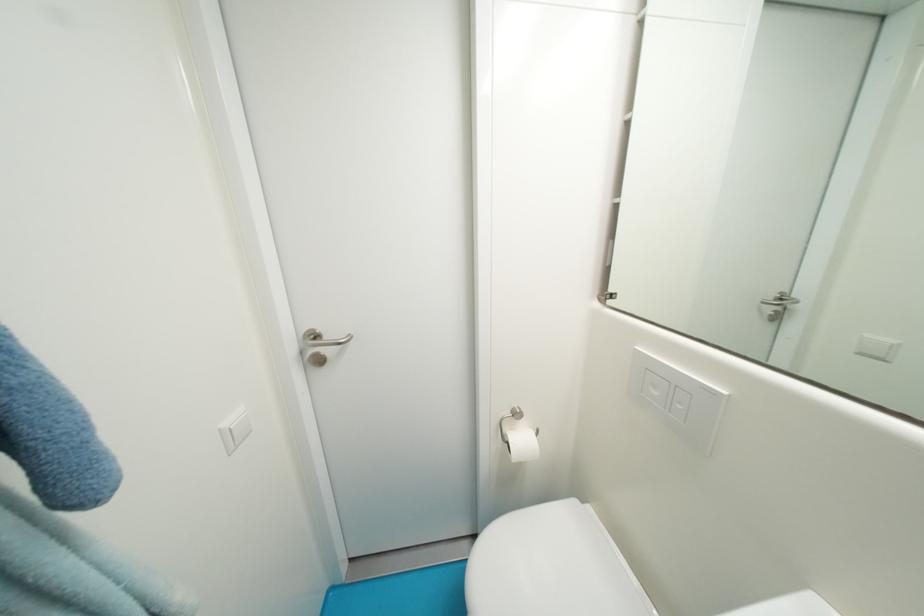
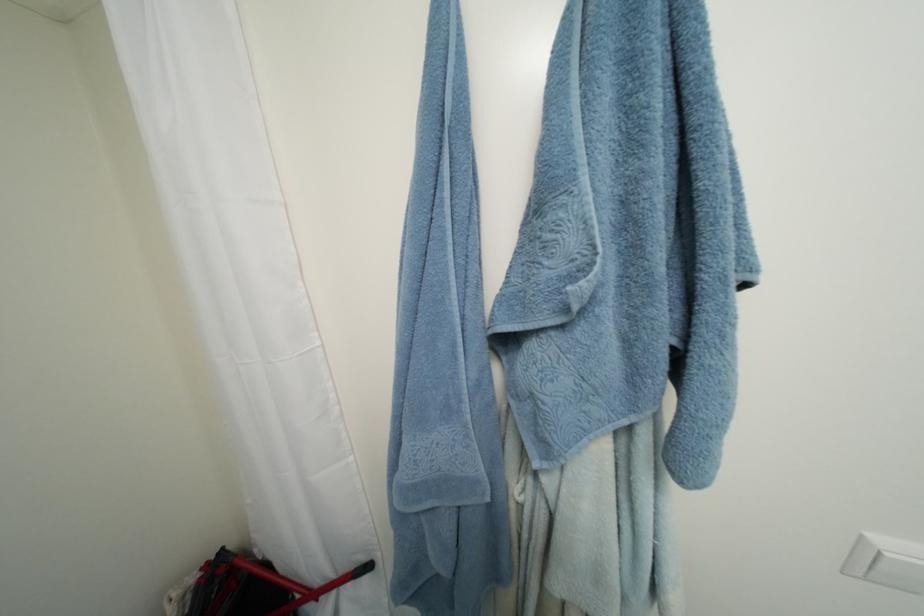
The point at [239,440] is marked in the first image. Where is the corresponding point in the second image?

(880, 570)